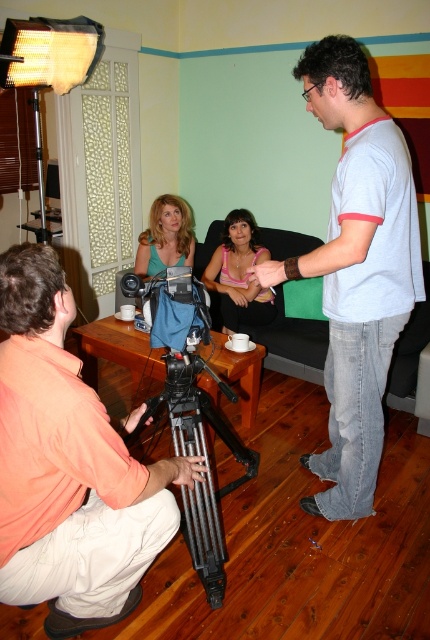
Question: Among these objects, which one is nearest to the camera?

Choices:
 (A) matte black hand at lower left
 (B) matte black hand at center
 (C) black matte tripod at lower center
 (D) matte black tripod at lower center

Answer: (D)

Question: In this image, where is black matte tripod at lower center located relative to matte black tripod at lower center?

Choices:
 (A) left
 (B) right

Answer: (B)

Question: Among these points, which one is farthest from the camera?

Choices:
 (A) pyautogui.click(x=251, y=216)
 (B) pyautogui.click(x=183, y=481)
 (C) pyautogui.click(x=267, y=259)

Answer: (A)

Question: Is the position of blonde hair at center more distant than that of matte black hand at lower left?

Choices:
 (A) yes
 (B) no

Answer: (A)

Question: Is black matte tripod at lower center bigger than matte black hand at center?

Choices:
 (A) yes
 (B) no

Answer: (A)

Question: Among these objects, which one is farthest from the camera?

Choices:
 (A) matte black tripod at lower center
 (B) black matte tripod at lower center
 (C) pink fabric top at center
 (D) blonde hair at center

Answer: (D)